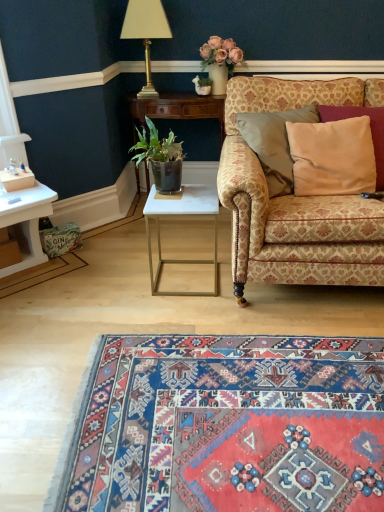
This screenshot has height=512, width=384. Find the location of `vacant area that lies in front of white marble table at center, the first table positioned from the bottom`. vacant area that lies in front of white marble table at center, the first table positioned from the bottom is located at coordinates (187, 316).